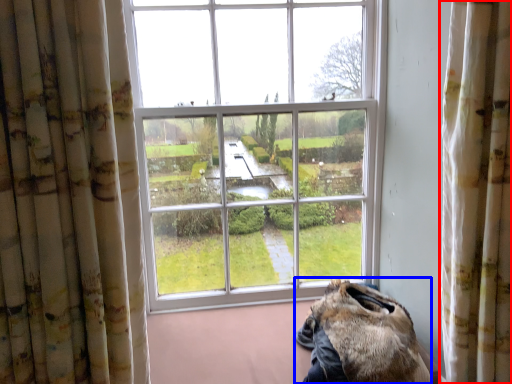
Question: Which object appears farthest to the camera in this image, curtain (highlighted by a red box) or animal (highlighted by a blue box)?

Choices:
 (A) curtain
 (B) animal

Answer: (B)